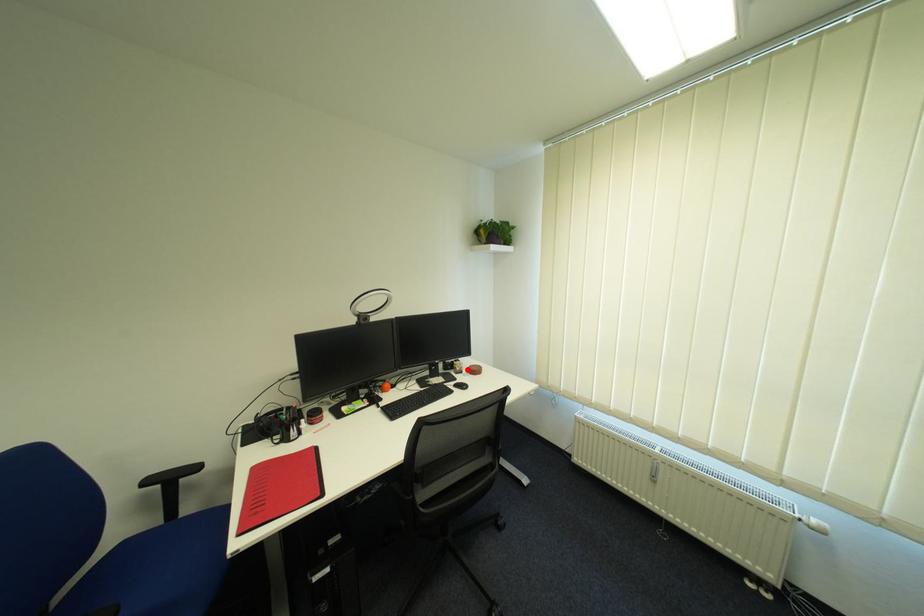
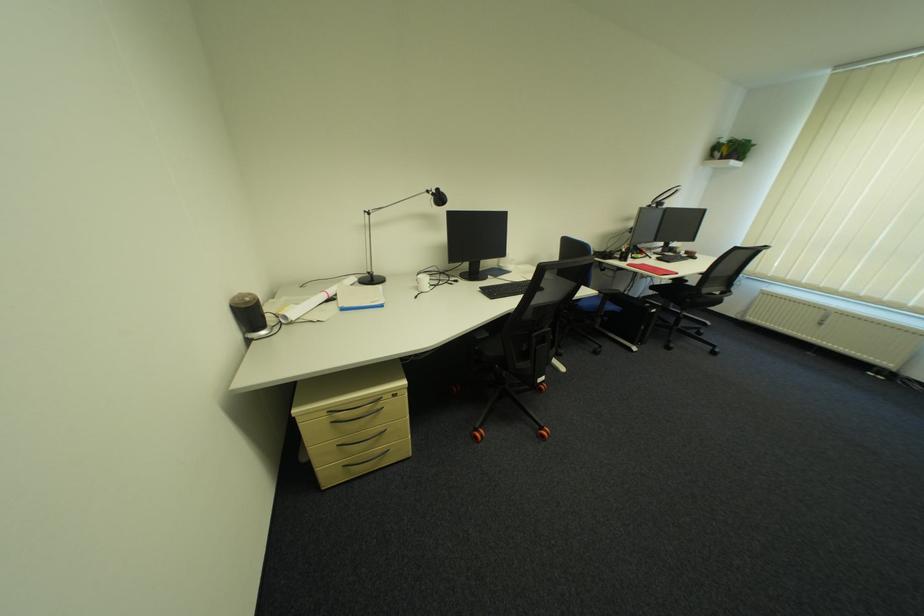
Question: I am providing you with two images of the same scene from different viewpoints. In image1, a red point is highlighted. Considering the same 3D point in image2, which of the following is correct?

Choices:
 (A) It is closer
 (B) It is farther

Answer: (A)